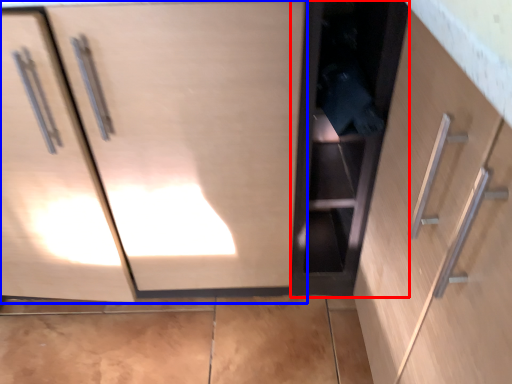
Question: Among these objects, which one is farthest to the camera, cabinetry (highlighted by a red box) or cabinetry (highlighted by a blue box)?

Choices:
 (A) cabinetry
 (B) cabinetry

Answer: (A)